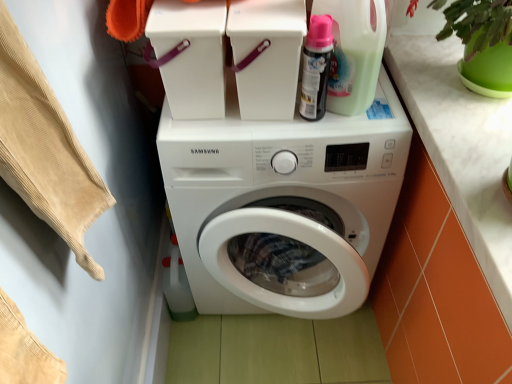
At what (x,y) coordinates should I click in order to perform the action: click on free location in front of matte black spray can at upper right, which is counted as the second cleaning product, starting from the right. Please return your answer as a coordinate pair (x, y). This screenshot has width=512, height=384. Looking at the image, I should click on (316, 135).